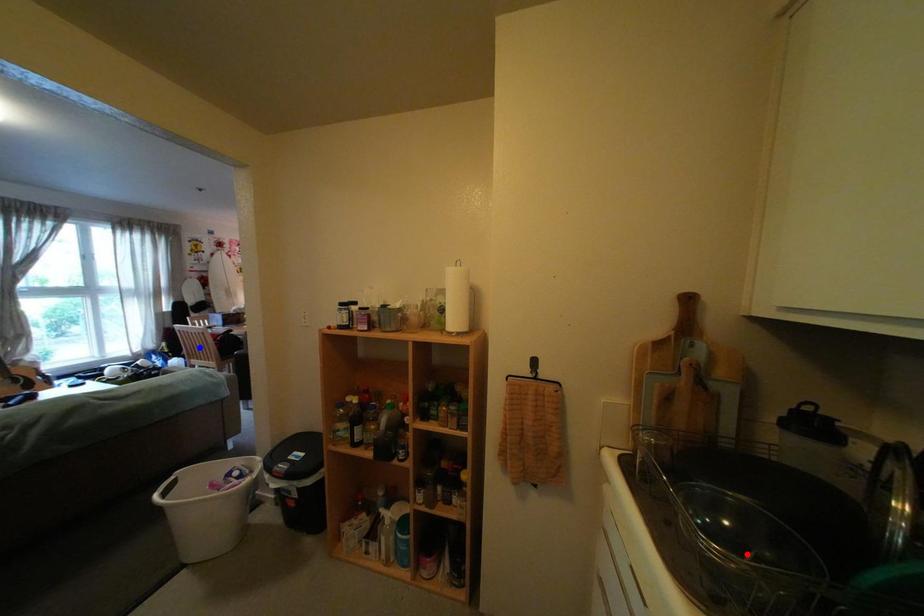
Question: Two points are marked on the image. Which point is closer to the camera?

Choices:
 (A) Blue point is closer.
 (B) Red point is closer.

Answer: (B)